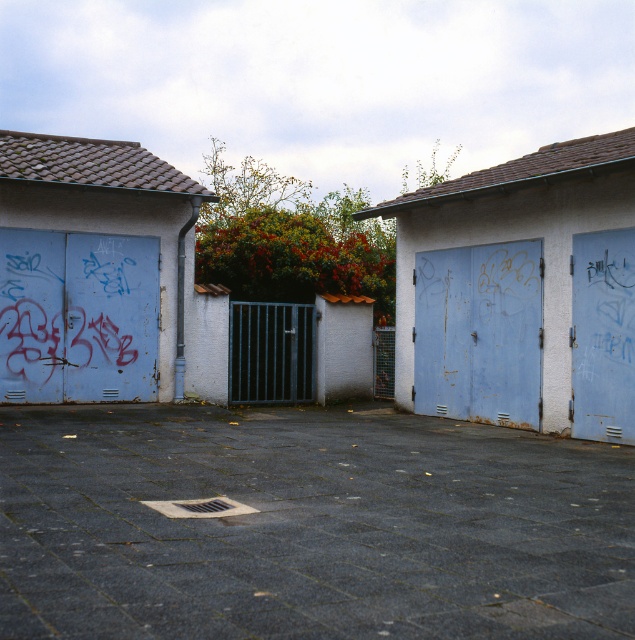
Describe the element at coordinates (100, 275) in the screenshot. The width and height of the screenshot is (635, 640). I see `light blue painted metal garage door at left` at that location.

Which is in front, point (127, 310) or point (304, 381)?

Positioned in front is point (127, 310).

Which is in front, point (30, 230) or point (269, 326)?

Point (30, 230) is in front.

Where is `light blue painted metal garage door at left`? This screenshot has width=635, height=640. light blue painted metal garage door at left is located at coordinates (100, 275).

Between point (615, 378) and point (262, 365), which one is positioned in front?

Point (615, 378) is more forward.

Can you confirm if rusty metal door at right is positioned above metallic gate at center?

Yes, rusty metal door at right is above metallic gate at center.

This screenshot has height=640, width=635. In order to click on rusty metal door at right in this screenshot , I will do coord(603,336).

Who is positioned more to the right, light blue painted metal garage door at left or rusty metal door at right?

rusty metal door at right is more to the right.

Who is higher up, light blue painted metal garage door at left or rusty metal door at right?

light blue painted metal garage door at left

Does point (23, 161) come behind point (622, 296)?

Yes, it is behind point (622, 296).

Identify the location of light blue painted metal garage door at left. This screenshot has height=640, width=635. (100, 275).